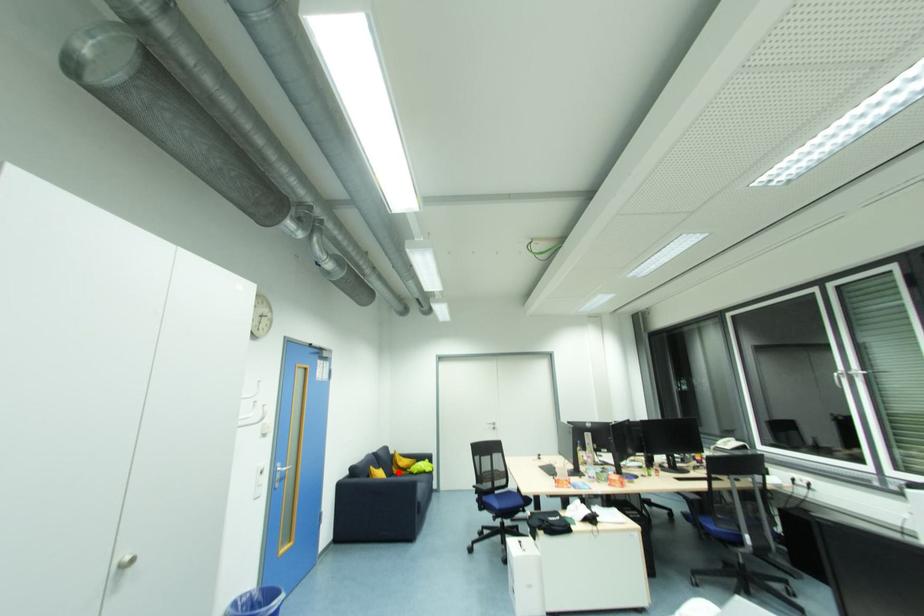
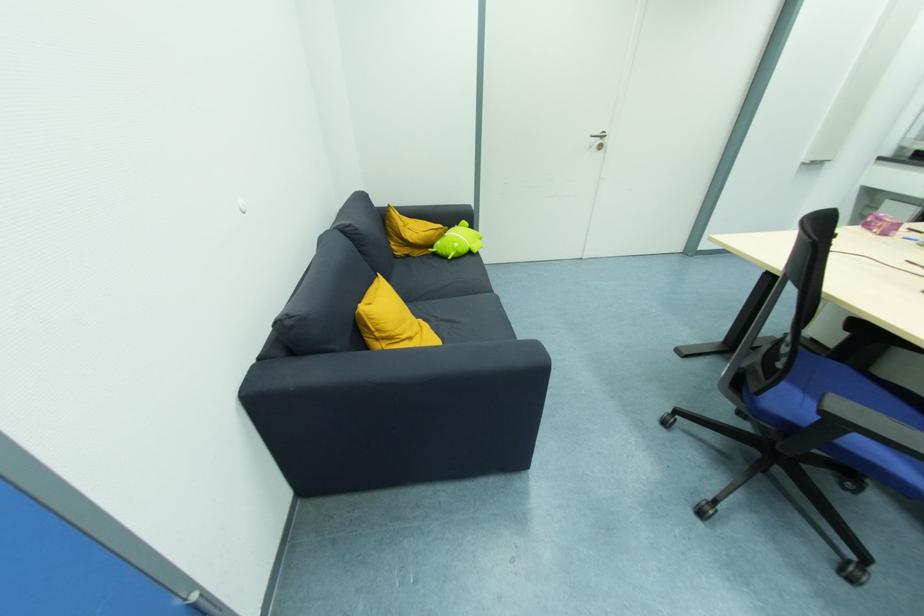
Question: I am providing you with two images of the same scene from different viewpoints. A red point is shown in image1. For the corresponding object point in image2, is it positioned nearer or farther from the camera?

Choices:
 (A) Nearer
 (B) Farther

Answer: (A)